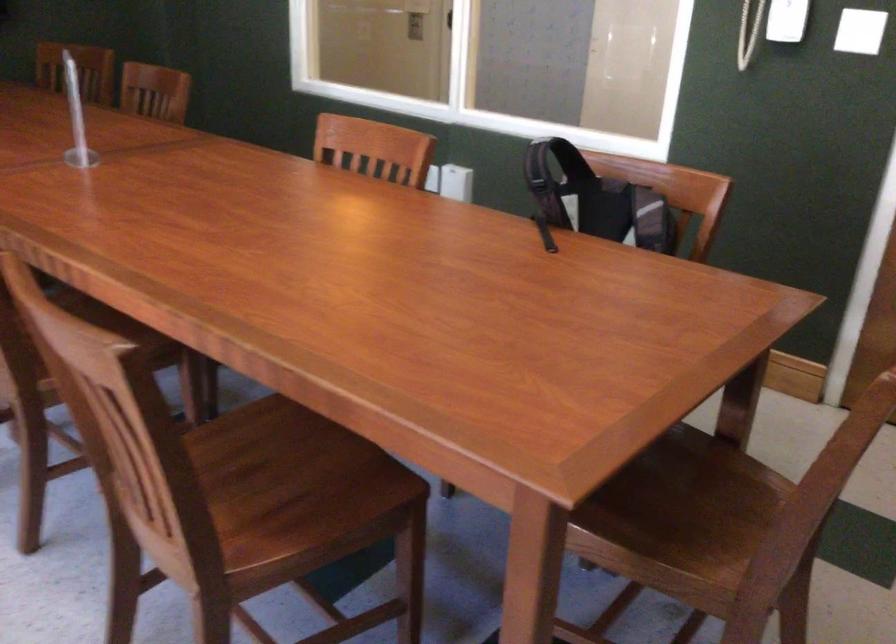
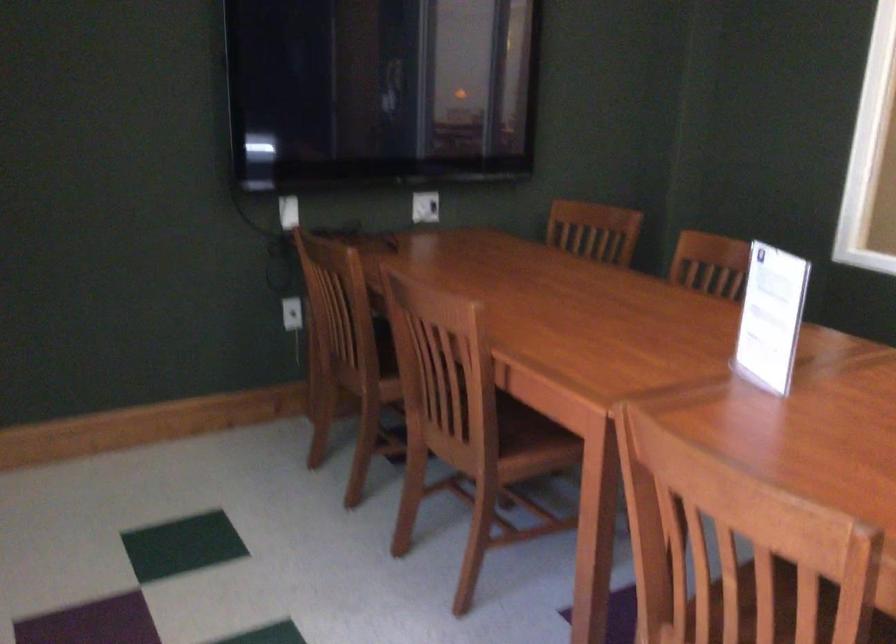
Which direction would the cameraman need to move to produce the second image?

The cameraman walked toward left, forward.